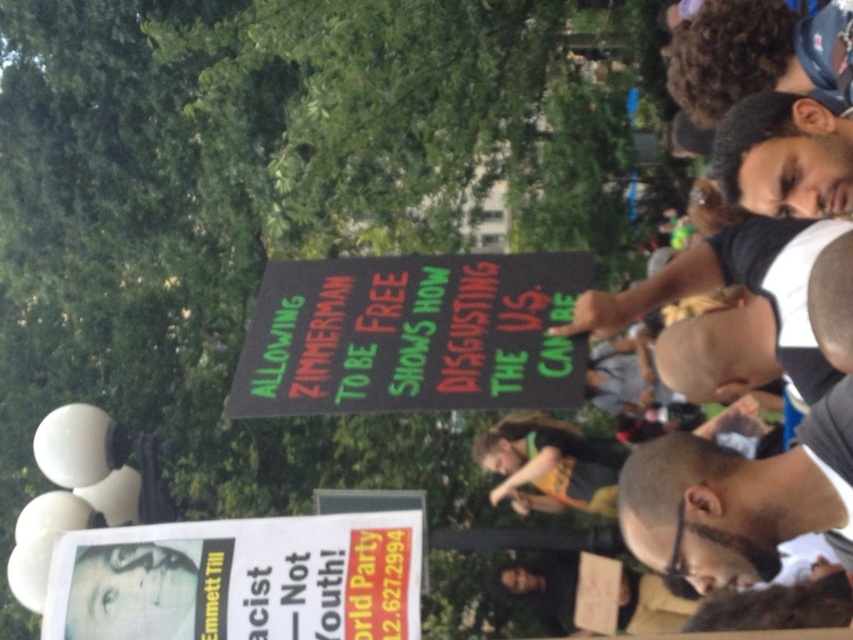
Who is more forward, (686, 483) or (834, 164)?

Point (686, 483)

Where is `dark brown hair at center`? The image size is (853, 640). dark brown hair at center is located at coordinates (738, 499).